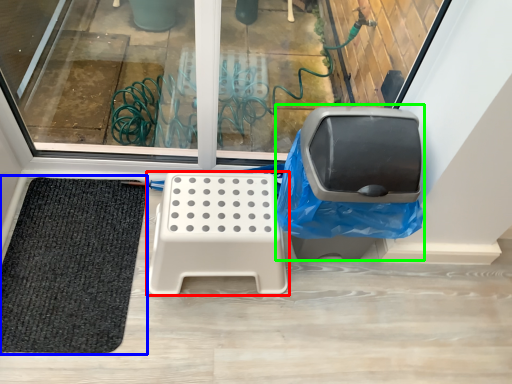
Question: Which object is positioned farthest from furniture (highlighted by a red box)? Select from mat (highlighted by a blue box) and swivel chair (highlighted by a green box).

Choices:
 (A) mat
 (B) swivel chair

Answer: (A)